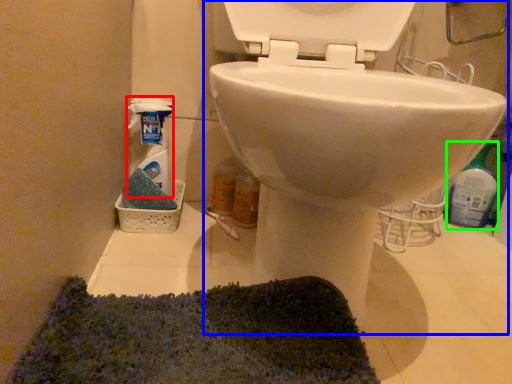
Question: Considering the real-world distances, which object is farthest from cleaning product (highlighted by a red box)? toilet (highlighted by a blue box) or cleaning product (highlighted by a green box)?

Choices:
 (A) toilet
 (B) cleaning product

Answer: (B)